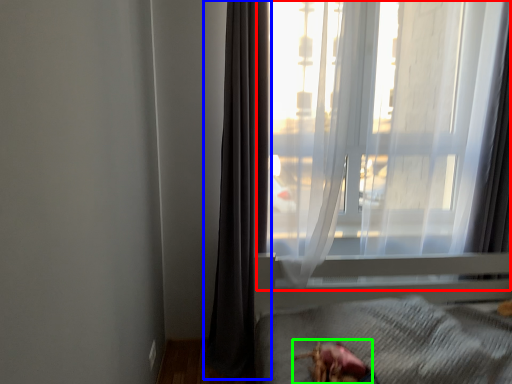
Question: Which object is the closest to the window (highlighted by a red box)? Choose among these: curtain (highlighted by a blue box) or animal (highlighted by a green box).

Choices:
 (A) curtain
 (B) animal

Answer: (A)